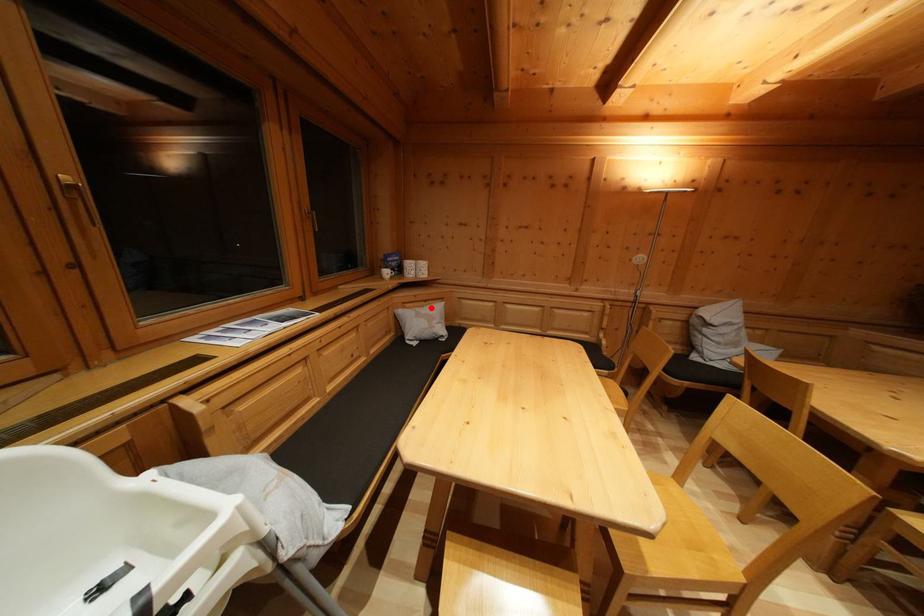
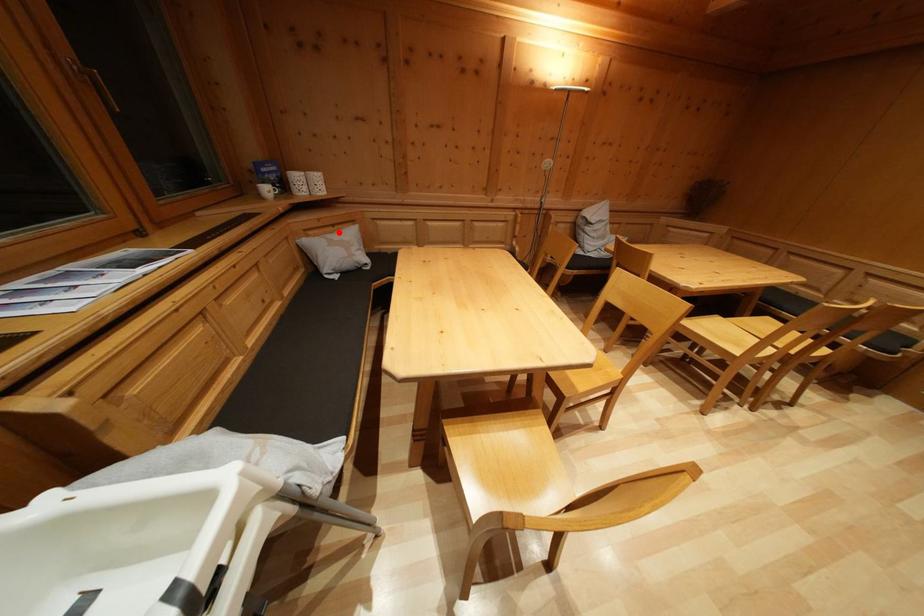
I am providing you with two images of the same scene from different viewpoints. A red point is marked on the first image and another point is marked on the second image. Is the marked point in image1 the same physical position as the marked point in image2?

Yes